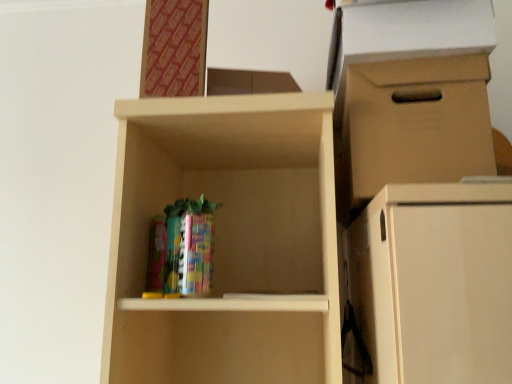
This screenshot has height=384, width=512. What do you see at coordinates (413, 124) in the screenshot? I see `brown cardboard box at upper right` at bounding box center [413, 124].

Image resolution: width=512 pixels, height=384 pixels. What are the coordinates of `brown cardboard box at upper right` in the screenshot? It's located at (413, 124).

Image resolution: width=512 pixels, height=384 pixels. Find the location of `brown cardboard box at upper right`. brown cardboard box at upper right is located at coordinates (413, 124).